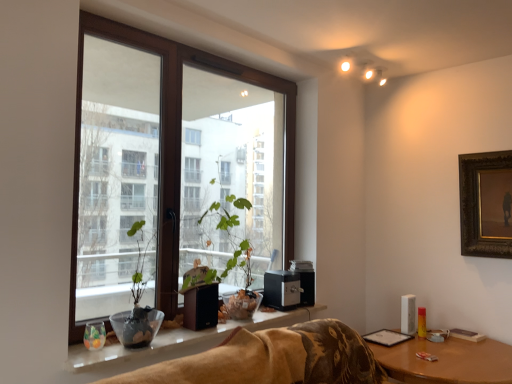
Question: Would you say white glossy window sill at lower center is a long distance from brown wooden table at lower right?

Choices:
 (A) no
 (B) yes

Answer: (A)

Question: From a real-world perspective, is white glossy window sill at lower center on brown wooden table at lower right?

Choices:
 (A) yes
 (B) no

Answer: (A)

Question: Is white glossy window sill at lower center at the left side of brown wooden table at lower right?

Choices:
 (A) yes
 (B) no

Answer: (A)

Question: From the image's perspective, does white glossy window sill at lower center appear higher than brown wooden table at lower right?

Choices:
 (A) yes
 (B) no

Answer: (A)

Question: Is white glossy window sill at lower center positioned in front of brown wooden table at lower right?

Choices:
 (A) no
 (B) yes

Answer: (B)

Question: Considering the positions of white glossy window sill at lower center and gold-framed painting at upper right in the image, is white glossy window sill at lower center taller or shorter than gold-framed painting at upper right?

Choices:
 (A) tall
 (B) short

Answer: (B)

Question: Based on their positions, is white glossy window sill at lower center located to the left or right of gold-framed painting at upper right?

Choices:
 (A) left
 (B) right

Answer: (A)

Question: From a real-world perspective, is white glossy window sill at lower center above or below gold-framed painting at upper right?

Choices:
 (A) above
 (B) below

Answer: (B)

Question: Is white glossy window sill at lower center in front of or behind gold-framed painting at upper right in the image?

Choices:
 (A) behind
 (B) front

Answer: (B)

Question: In terms of width, does brown wooden table at lower right look wider or thinner when compared to gold-framed painting at upper right?

Choices:
 (A) wide
 (B) thin

Answer: (A)

Question: Is brown wooden table at lower right inside or outside of gold-framed painting at upper right?

Choices:
 (A) inside
 (B) outside

Answer: (B)

Question: Visually, is brown wooden table at lower right positioned to the left or to the right of gold-framed painting at upper right?

Choices:
 (A) right
 (B) left

Answer: (B)

Question: From a real-world perspective, is brown wooden table at lower right positioned above or below gold-framed painting at upper right?

Choices:
 (A) below
 (B) above

Answer: (A)

Question: From their relative heights in the image, would you say white glossy window sill at lower center is taller or shorter than green matte plant at center?

Choices:
 (A) tall
 (B) short

Answer: (B)

Question: Would you say white glossy window sill at lower center is to the left or to the right of green matte plant at center in the picture?

Choices:
 (A) left
 (B) right

Answer: (B)